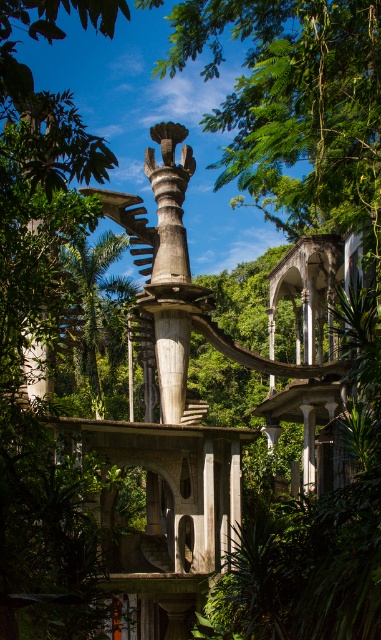
In the scene shown: You are standing at the entrance of the architectural complex and want to take a photo that includes both the wooden sculpture at center and the green leafy tree at center. Based on their distance, can you estimate if they will both fit in your camera frame if your camera has a 50mm lens?

The wooden sculpture at center is 16.59 meters away from the green leafy tree at center. With a 50mm lens, which has a moderate field of view, both objects can likely fit in the frame since they are positioned at a similar distance from the camera. Adjust your position slightly to ensure both are centered and in focus.

You are an architect evaluating the space between the wooden sculpture at center and the green leafy tree at center. Can you determine which one is narrower?

The wooden sculpture at center has a lesser width compared to the green leafy tree at center, so the wooden sculpture at center is narrower.